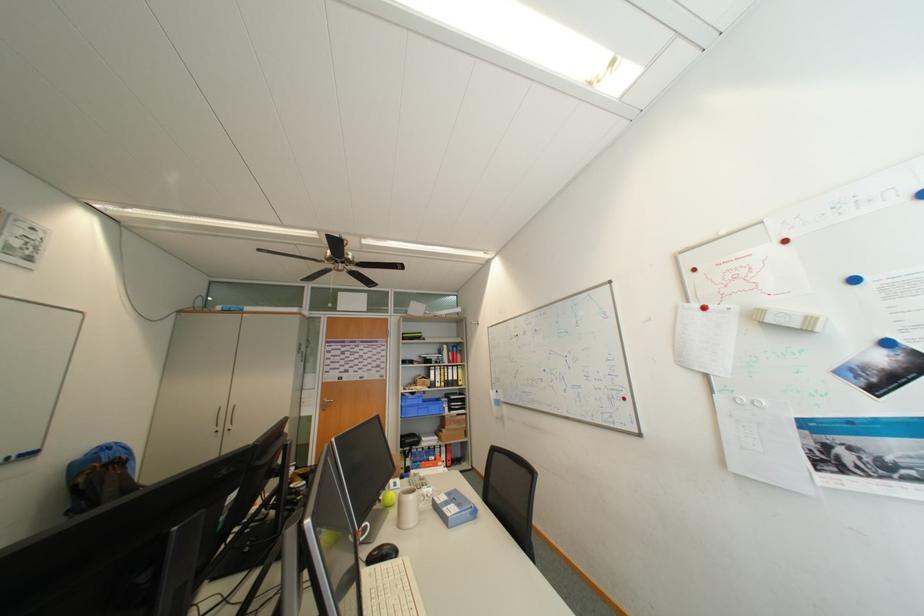
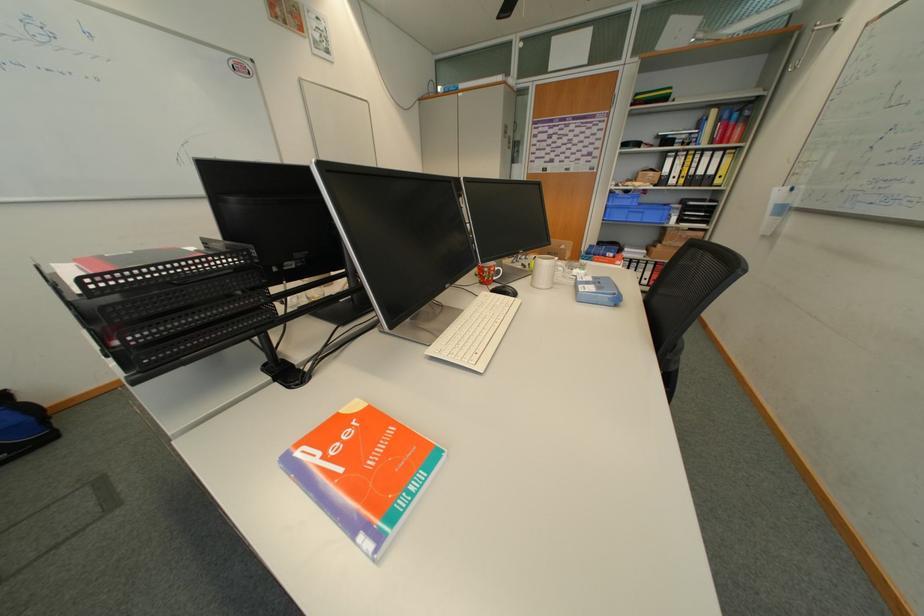
How did the camera likely rotate?

The rotation direction of the camera is left-down.